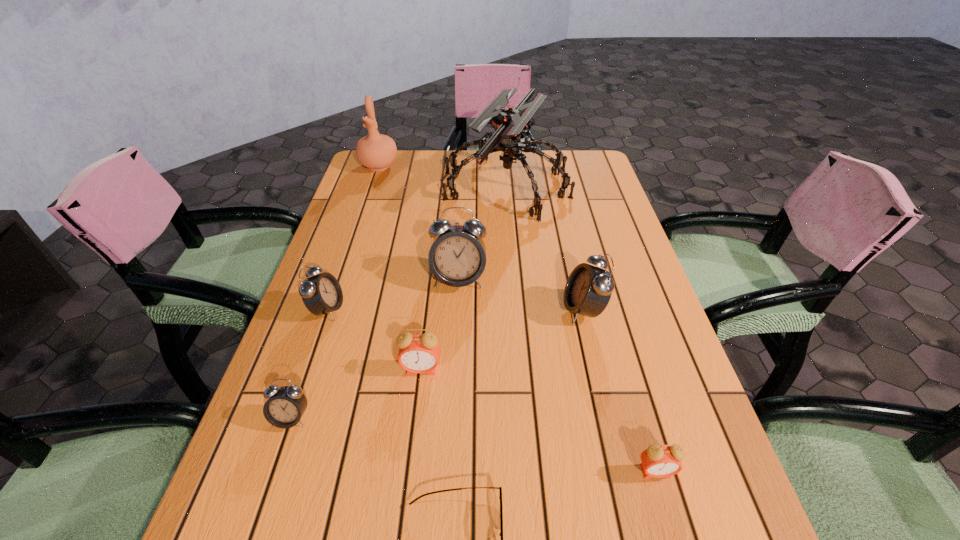
Where is `vacant space at the right edge of the desktop`? The width and height of the screenshot is (960, 540). vacant space at the right edge of the desktop is located at coordinates (656, 503).

I want to click on vacant space at the far left corner of the desktop, so click(x=371, y=174).

What are the coordinates of `free space between the fourth farthest alarm clock and the pottery` in the screenshot? It's located at (400, 268).

Where is `free area in between the biggest white alarm clock and the eighth farthest object`? free area in between the biggest white alarm clock and the eighth farthest object is located at coordinates (557, 375).

Image resolution: width=960 pixels, height=540 pixels. Find the location of `free spot between the eighth farthest object and the second smallest white alarm clock`. free spot between the eighth farthest object and the second smallest white alarm clock is located at coordinates point(492,390).

The width and height of the screenshot is (960, 540). I want to click on vacant area between the eighth shortest object and the bigger pink alarm clock, so click(400, 268).

Where is `vacant space that is in between the nearer pink alarm clock and the pottery`? The height and width of the screenshot is (540, 960). vacant space that is in between the nearer pink alarm clock and the pottery is located at coordinates (517, 319).

Locate an element on the screen. vacant point located between the nearest alarm clock and the left pink alarm clock is located at coordinates (539, 420).

Find the location of a particular element. This screenshot has height=540, width=960. vacant area that lies between the smallest white alarm clock and the third biggest white alarm clock is located at coordinates (309, 363).

Identify the location of object that is the closest one to the eighth shortest object. This screenshot has height=540, width=960. (509, 123).